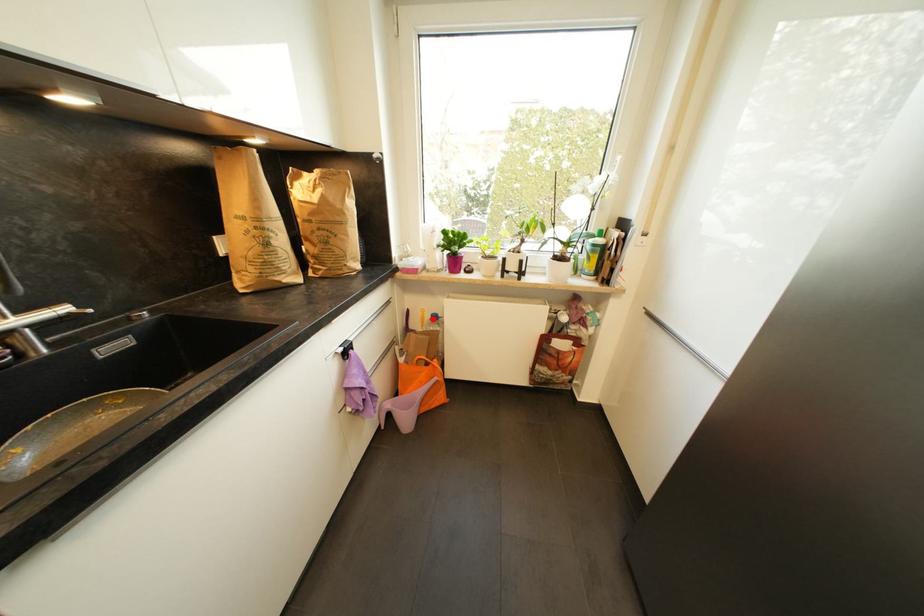
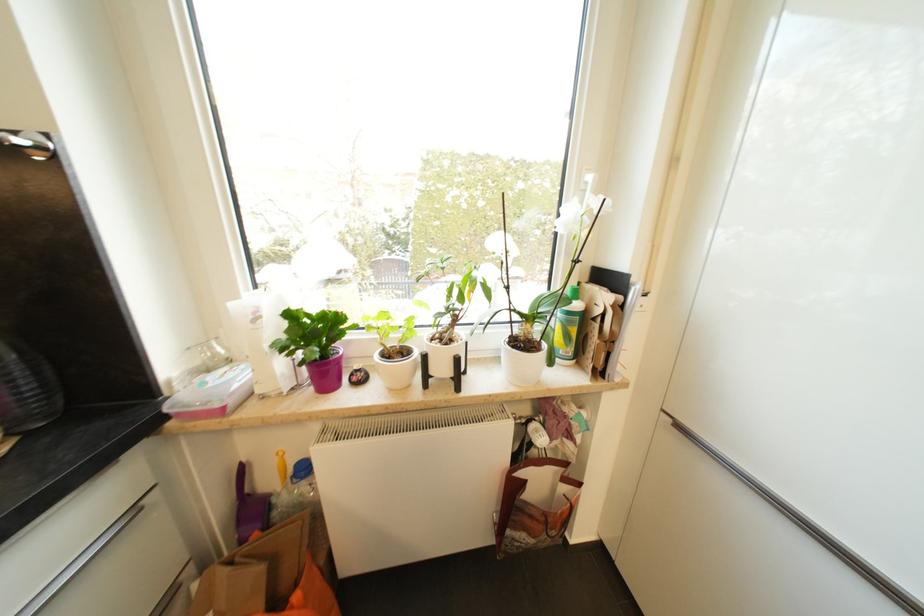
Find the pixel in the second image that matches the highlighted location in the first image.

(295, 471)